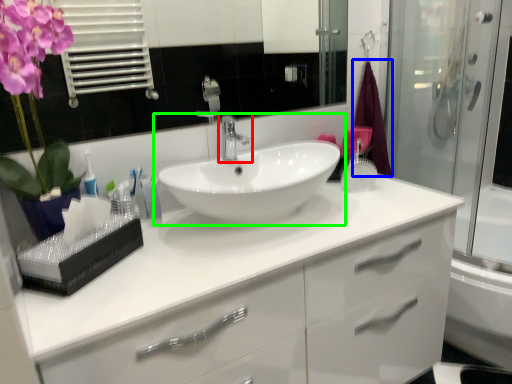
Question: Estimate the real-world distances between objects in this image. Which object is closer to tap (highlighted by a red box), bath towel (highlighted by a blue box) or sink (highlighted by a green box)?

Choices:
 (A) bath towel
 (B) sink

Answer: (B)